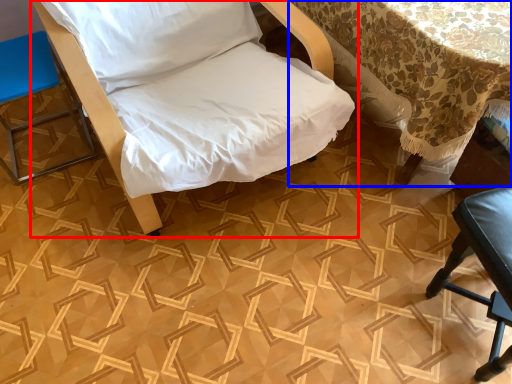
Question: Which of the following is the closest to the observer, furniture (highlighted by a red box) or table (highlighted by a blue box)?

Choices:
 (A) furniture
 (B) table

Answer: (A)